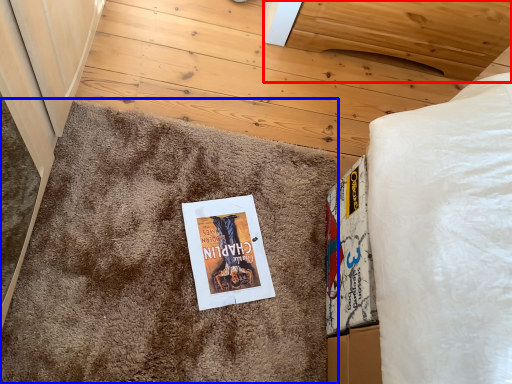
Question: Among these objects, which one is nearest to the camera, furniture (highlighted by a red box) or doormat (highlighted by a blue box)?

Choices:
 (A) furniture
 (B) doormat

Answer: (B)